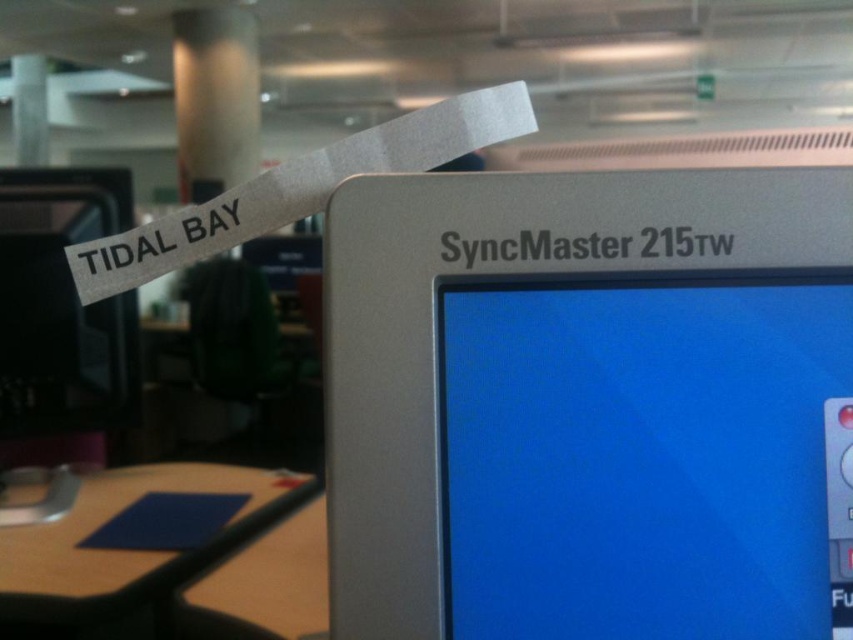
Can you confirm if silver metallic monitor at center is positioned below matte black monitor at left?

Correct, silver metallic monitor at center is located below matte black monitor at left.

Does silver metallic monitor at center appear over matte black monitor at left?

No, silver metallic monitor at center is not above matte black monitor at left.

Is point (643, 374) positioned in front of point (137, 378)?

Yes, point (643, 374) is closer to viewer.

Where is `silver metallic monitor at center`? silver metallic monitor at center is located at coordinates (584, 403).

What do you see at coordinates (61, 317) in the screenshot? This screenshot has width=853, height=640. I see `matte black monitor at left` at bounding box center [61, 317].

Who is more forward, (x=105, y=224) or (x=254, y=484)?

Point (x=254, y=484) is in front.

Identify the location of matte black monitor at left. This screenshot has height=640, width=853. (61, 317).

Who is more distant from viewer, (564, 259) or (207, 556)?

Positioned behind is point (207, 556).

Does point (693, 438) lie behind point (132, 634)?

No.

Locate an element on the screen. The width and height of the screenshot is (853, 640). silver metallic monitor at center is located at coordinates (584, 403).